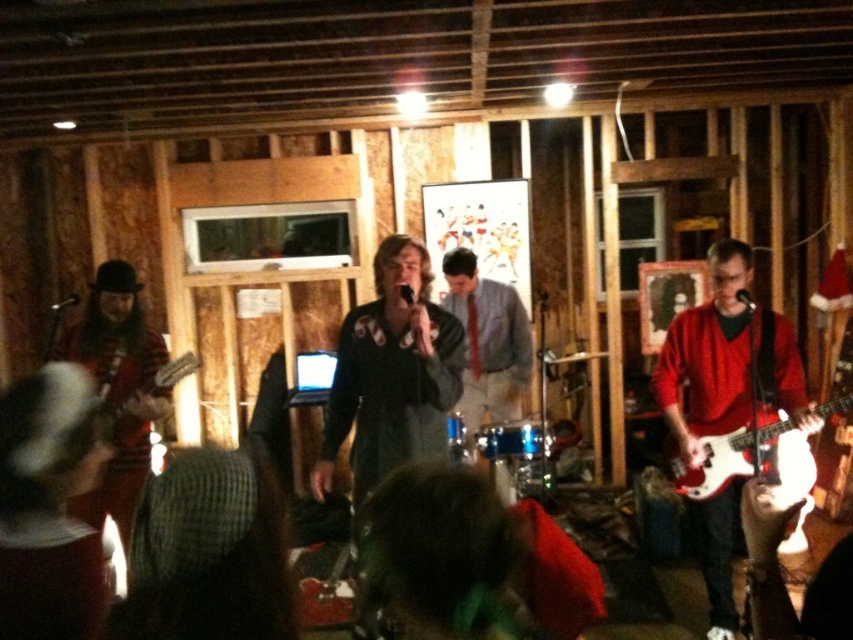
Consider the image. You are standing at the camera position and want to move towards the point at coordinates point (457, 276) and point (167, 376). Which point will you reach first?

You will reach point (167, 376) first because it is closer to you than point (457, 276), which is further away.

You are a photographer at the live music performance. You want to capture a photo that includes both the red glossy electric guitar at right and the blue fabric tie at center. Based on their positions, will the guitar appear above or below the tie in the photo?

The red glossy electric guitar at right is below the blue fabric tie at center, so in the photo, the guitar will appear below the tie.